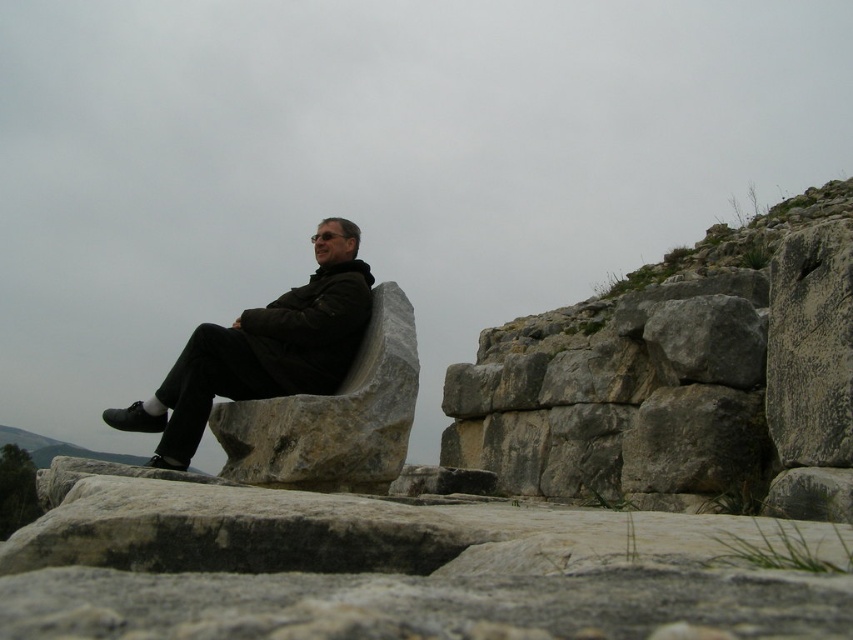
Is matte black jacket at center above gray stone boulder at center?

Indeed, matte black jacket at center is positioned over gray stone boulder at center.

Can you confirm if matte black jacket at center is smaller than gray stone boulder at center?

No, matte black jacket at center is not smaller than gray stone boulder at center.

Between point (148, 404) and point (221, 406), which one is positioned in front?

Point (221, 406) is more forward.

Find the location of a particular element. matte black jacket at center is located at coordinates (262, 349).